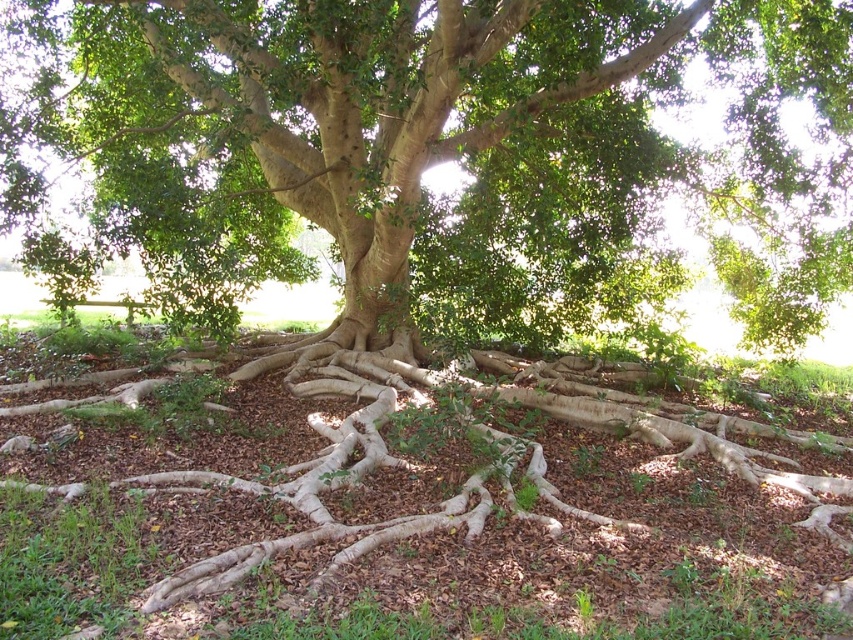
Question: Which of the following is the farthest from the observer?

Choices:
 (A) brown mulch at center
 (B) green matte tree at center

Answer: (B)

Question: Is green matte tree at center thinner than brown mulch at center?

Choices:
 (A) no
 (B) yes

Answer: (A)

Question: Can you confirm if green matte tree at center is wider than brown mulch at center?

Choices:
 (A) yes
 (B) no

Answer: (A)

Question: Is green matte tree at center smaller than brown mulch at center?

Choices:
 (A) no
 (B) yes

Answer: (A)